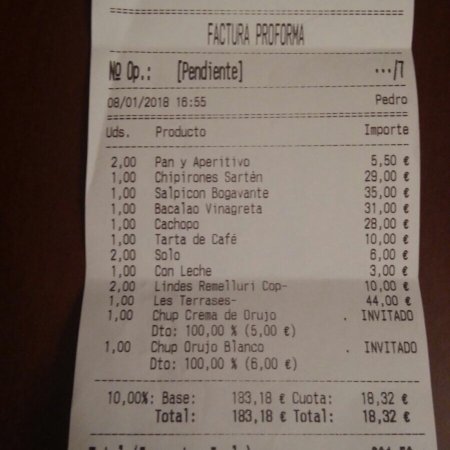
At what (x,y) coordinates should I click in order to perform the action: click on countertop. Please return your answer as a coordinate pair (x, y). Looking at the image, I should click on (60, 284), (441, 291).